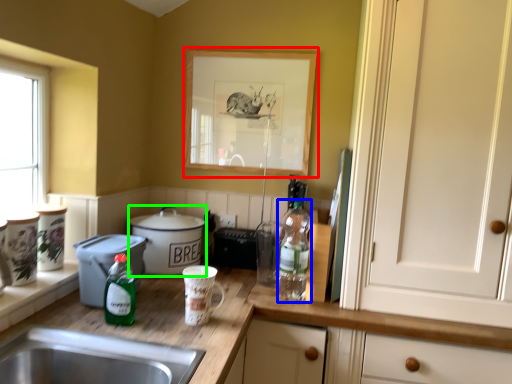
Question: Considering the real-world distances, which object is farthest from picture frame (highlighted by a red box)? bottle (highlighted by a blue box) or cooker (highlighted by a green box)?

Choices:
 (A) bottle
 (B) cooker

Answer: (B)